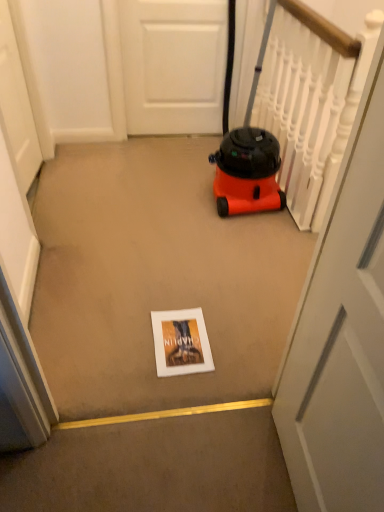
What is the approximate width of white matte door at upper center, the second door positioned from the left?

It is 3.16 centimeters.

Image resolution: width=384 pixels, height=512 pixels. I want to click on white matte door at upper center, marked as the 2th door in a right-to-left arrangement, so pyautogui.click(x=173, y=65).

Where is `orange matte vacuum cleaner at center-right`? orange matte vacuum cleaner at center-right is located at coordinates (246, 149).

Locate an element on the screen. white glossy door at center, which is the third door from back to front is located at coordinates (342, 343).

Locate an element on the screen. This screenshot has height=512, width=384. white matte door at left, which is the second door in front-to-back order is located at coordinates (17, 104).

Is white matte door at left, the second door in the back-to-front sequence, far away from orange matte vacuum cleaner at center-right?

white matte door at left, the second door in the back-to-front sequence, is positioned a significant distance from orange matte vacuum cleaner at center-right.

From the image's perspective, is white matte door at left, which is the second door in front-to-back order, above or below orange matte vacuum cleaner at center-right?

From the image's perspective, white matte door at left, which is the second door in front-to-back order, appears below orange matte vacuum cleaner at center-right.

Who is smaller, white matte door at left, positioned as the 3th door in right-to-left order, or orange matte vacuum cleaner at center-right?

white matte door at left, positioned as the 3th door in right-to-left order.

Consider the image. How many degrees apart are the facing directions of white matte door at left, positioned as the 3th door in right-to-left order, and orange matte vacuum cleaner at center-right?

The angle between the facing direction of white matte door at left, positioned as the 3th door in right-to-left order, and the facing direction of orange matte vacuum cleaner at center-right is 91.5 degrees.

Would you consider orange matte vacuum cleaner at center-right to be distant from matte white book at center?

No.

From the image's perspective, which one is positioned lower, orange matte vacuum cleaner at center-right or matte white book at center?

matte white book at center appears lower in the image.

Can you confirm if orange matte vacuum cleaner at center-right is thinner than matte white book at center?

No, orange matte vacuum cleaner at center-right is not thinner than matte white book at center.

Can you confirm if orange matte vacuum cleaner at center-right is bigger than white matte door at left, which is the second door in front-to-back order?

Indeed, orange matte vacuum cleaner at center-right has a larger size compared to white matte door at left, which is the second door in front-to-back order.

Is orange matte vacuum cleaner at center-right surrounding white matte door at left, which is the second door in front-to-back order?

That's incorrect, white matte door at left, which is the second door in front-to-back order, is not inside orange matte vacuum cleaner at center-right.

Could you tell me if orange matte vacuum cleaner at center-right is turned towards white matte door at left, the second door in the back-to-front sequence?

No, orange matte vacuum cleaner at center-right is not facing towards white matte door at left, the second door in the back-to-front sequence.

Are orange matte vacuum cleaner at center-right and white matte door at left, the second door in the back-to-front sequence, making contact?

No, orange matte vacuum cleaner at center-right is not making contact with white matte door at left, the second door in the back-to-front sequence.

Considering the sizes of objects orange matte vacuum cleaner at center-right and white glossy door at center, which is the third door from back to front, in the image provided, who is bigger, orange matte vacuum cleaner at center-right or white glossy door at center, which is the third door from back to front,?

With larger size is orange matte vacuum cleaner at center-right.

Which object is wider, orange matte vacuum cleaner at center-right or white glossy door at center, which is counted as the third door, starting from the left?

orange matte vacuum cleaner at center-right is wider.

Is orange matte vacuum cleaner at center-right in contact with white glossy door at center, marked as the first door in a front-to-back arrangement?

orange matte vacuum cleaner at center-right and white glossy door at center, marked as the first door in a front-to-back arrangement, are clearly separated.

From the image's perspective, is orange matte vacuum cleaner at center-right positioned above or below white matte door at upper center, the second door positioned from the left?

orange matte vacuum cleaner at center-right is below white matte door at upper center, the second door positioned from the left.

Looking at this image, is orange matte vacuum cleaner at center-right positioned with its back to white matte door at upper center, marked as the 2th door in a right-to-left arrangement?

That's right, orange matte vacuum cleaner at center-right is facing away from white matte door at upper center, marked as the 2th door in a right-to-left arrangement.

How different are the orientations of orange matte vacuum cleaner at center-right and white matte door at upper center, marked as the 2th door in a right-to-left arrangement, in degrees?

They differ by 0.919 degrees in their facing directions.

Which object is positioned more to the right, orange matte vacuum cleaner at center-right or white matte door at upper center, the second door positioned from the left?

From the viewer's perspective, orange matte vacuum cleaner at center-right appears more on the right side.

Where is `equipment above the white glossy door at center, which is counted as the third door, starting from the left (from the image's perspective)`? This screenshot has height=512, width=384. equipment above the white glossy door at center, which is counted as the third door, starting from the left (from the image's perspective) is located at coordinates (x=246, y=149).

In terms of height, does white glossy door at center, which is the third door from back to front, look taller or shorter compared to orange matte vacuum cleaner at center-right?

Clearly, white glossy door at center, which is the third door from back to front, is taller compared to orange matte vacuum cleaner at center-right.

Is white glossy door at center, which is the third door from back to front, positioned with its back to orange matte vacuum cleaner at center-right?

No, orange matte vacuum cleaner at center-right is not at the back of white glossy door at center, which is the third door from back to front.

Considering the positions of objects white glossy door at center, arranged as the 1th door when viewed from the right, and orange matte vacuum cleaner at center-right in the image provided, who is behind, white glossy door at center, arranged as the 1th door when viewed from the right, or orange matte vacuum cleaner at center-right?

orange matte vacuum cleaner at center-right is more distant.

Does white matte door at left, the second door in the back-to-front sequence, contain matte white book at center?

No, matte white book at center is located outside of white matte door at left, the second door in the back-to-front sequence.

Based on the photo, from the image's perspective, is white matte door at left, the first door from the left, above or below matte white book at center?

white matte door at left, the first door from the left, is situated higher than matte white book at center in the image.

Are white matte door at left, the second door in the back-to-front sequence, and matte white book at center located far from each other?

white matte door at left, the second door in the back-to-front sequence, is positioned a significant distance from matte white book at center.

This screenshot has width=384, height=512. In order to click on equipment lying on the right of white matte door at left, the first door from the left in this screenshot , I will do `click(246, 149)`.

Find the location of a particular element. The height and width of the screenshot is (512, 384). copy below the orange matte vacuum cleaner at center-right (from a real-world perspective) is located at coordinates (181, 342).

In the scene shown: When comparing their distances from white matte door at left, which is the second door in front-to-back order, does matte white book at center or white glossy door at center, which is counted as the third door, starting from the left, seem further?

white glossy door at center, which is counted as the third door, starting from the left, lies further to white matte door at left, which is the second door in front-to-back order, than the other object.

From the image, which object appears to be farther from orange matte vacuum cleaner at center-right, white matte door at left, the first door from the left, or matte white book at center?

The object further to orange matte vacuum cleaner at center-right is white matte door at left, the first door from the left.

Based on their spatial positions, is white matte door at left, the second door in the back-to-front sequence, or matte white book at center further from white glossy door at center, which is counted as the third door, starting from the left?

The object further to white glossy door at center, which is counted as the third door, starting from the left, is white matte door at left, the second door in the back-to-front sequence.

From the image, which object appears to be farther from white matte door at upper center, the first door viewed from the back, white matte door at left, which is the second door in front-to-back order, or white glossy door at center, which is counted as the third door, starting from the left?

The object further to white matte door at upper center, the first door viewed from the back, is white glossy door at center, which is counted as the third door, starting from the left.

Looking at the image, which one is located closer to matte white book at center, orange matte vacuum cleaner at center-right or white matte door at upper center, the 3th door viewed from the front?

orange matte vacuum cleaner at center-right lies closer to matte white book at center than the other object.

Based on their spatial positions, is matte white book at center or white matte door at upper center, marked as the 2th door in a right-to-left arrangement, further from white glossy door at center, which is the third door from back to front?

white matte door at upper center, marked as the 2th door in a right-to-left arrangement, is positioned further to the anchor white glossy door at center, which is the third door from back to front.

Which object lies nearer to the anchor point white matte door at upper center, the first door viewed from the back, white matte door at left, positioned as the 3th door in right-to-left order, or matte white book at center?

white matte door at left, positioned as the 3th door in right-to-left order.

From the image, which object appears to be nearer to white glossy door at center, which is counted as the third door, starting from the left, white matte door at left, the second door in the back-to-front sequence, or white matte door at upper center, the second door positioned from the left?

white matte door at left, the second door in the back-to-front sequence, is positioned closer to the anchor white glossy door at center, which is counted as the third door, starting from the left.

The image size is (384, 512). I want to click on copy between white glossy door at center, marked as the first door in a front-to-back arrangement, and orange matte vacuum cleaner at center-right, along the z-axis, so click(181, 342).

The image size is (384, 512). What are the coordinates of `equipment that lies between white matte door at upper center, marked as the 2th door in a right-to-left arrangement, and matte white book at center from top to bottom` in the screenshot? It's located at (246, 149).

Find the location of `door positioned between white glossy door at center, marked as the first door in a front-to-back arrangement, and orange matte vacuum cleaner at center-right from near to far`. door positioned between white glossy door at center, marked as the first door in a front-to-back arrangement, and orange matte vacuum cleaner at center-right from near to far is located at coordinates (17, 104).

Where is `copy located between white glossy door at center, which is counted as the third door, starting from the left, and white matte door at upper center, the first door viewed from the back, in the depth direction`? copy located between white glossy door at center, which is counted as the third door, starting from the left, and white matte door at upper center, the first door viewed from the back, in the depth direction is located at coordinates (181, 342).